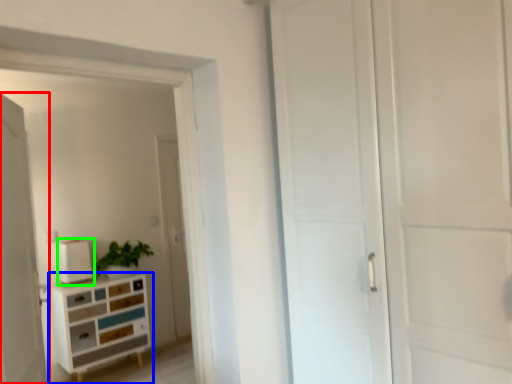
Question: Based on their relative distances, which object is farther from door (highlighted by a red box)? Choose from chest of drawers (highlighted by a blue box) and appliance (highlighted by a green box).

Choices:
 (A) chest of drawers
 (B) appliance

Answer: (B)